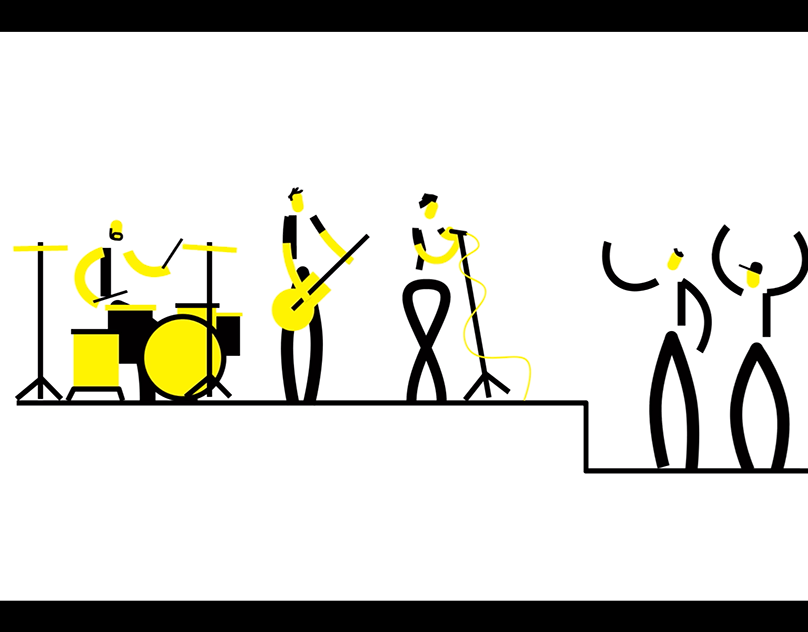
What are the coordinates of `black microphone stand` in the screenshot? It's located at [x=476, y=325].